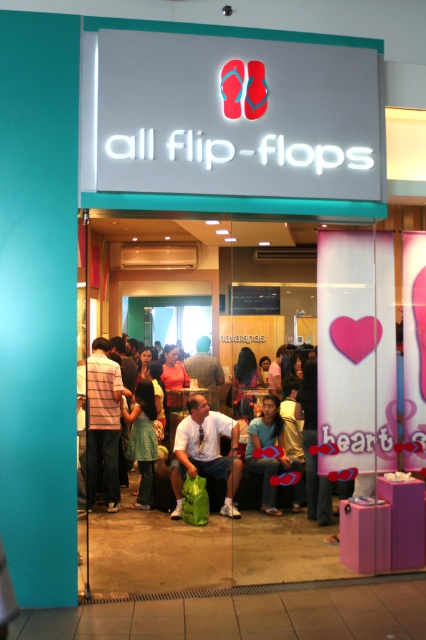
Question: Among these points, which one is nearest to the camera?

Choices:
 (A) (143, 506)
 (B) (203, 474)
 (C) (111, 508)

Answer: (B)

Question: Estimate the real-world distances between objects in this image. Which object is farther from the light blue denim jeans at center?

Choices:
 (A) striped shirt at center
 (B) blue denim jeans at center

Answer: (B)

Question: Which object is closer to the camera taking this photo?

Choices:
 (A) blue denim jeans at center
 (B) matte green bag at center
 (C) striped shirt at center

Answer: (B)

Question: Does light blue denim jeans at center appear on the left side of striped shirt at center?

Choices:
 (A) yes
 (B) no

Answer: (B)

Question: Is light blue denim jeans at center smaller than blue denim jeans at center?

Choices:
 (A) no
 (B) yes

Answer: (A)

Question: Does matte green bag at center have a lesser width compared to blue denim jeans at center?

Choices:
 (A) yes
 (B) no

Answer: (B)